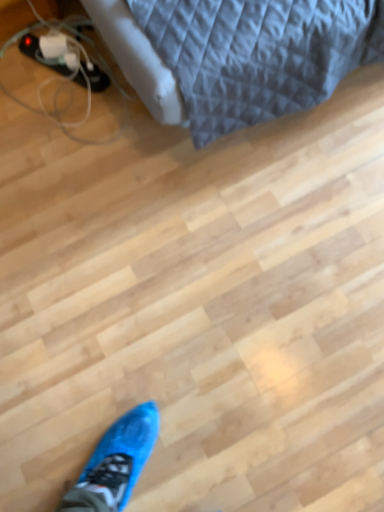
At what (x,y) coordinates should I click in order to perform the action: click on vacant space behind matte black shoe at upper left. Please return your answer as a coordinate pair (x, y). Image resolution: width=384 pixels, height=512 pixels. Looking at the image, I should click on (49, 19).